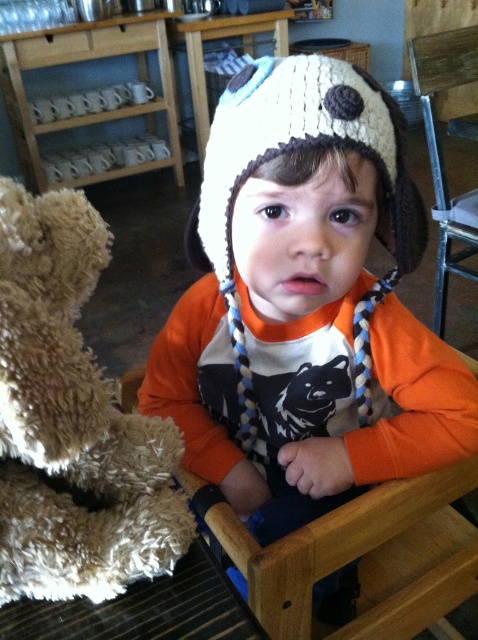
You are standing in the room where the child is sitting. There are two points marked in the scene. One is point (354, 141) and the other is point (46, 227). If you were to walk from the first point to the second point, would you be moving towards the child or away from them?

Moving towards the child because point (354, 141) is behind point (46, 227), so moving from the first to the second point would bring you closer to the child.

You are a tailor trying to determine if the white knitted hat at center can fit over the fuzzy beige teddy bear at left. Based on the provided scene, can you confirm if the hat is wide enough to cover the teddy bear?

The white knitted hat at center has a width larger than the fuzzy beige teddy bear at left, so it should be wide enough to cover the teddy bear.

You are a photographer setting up a shoot with the child and their belongings. You want to position a light source to the right of the white knitted hat at center so it illuminates both the hat and the fuzzy beige teddy bear at left. Is this possible given their positions?

The white knitted hat at center is to the right of the fuzzy beige teddy bear at left. Placing the light source to the right of the white knitted hat at center would still allow light to reach both objects since the hat is already positioned to the right of the teddy bear. The light can illuminate both by being positioned further right, casting light across the space towards them.